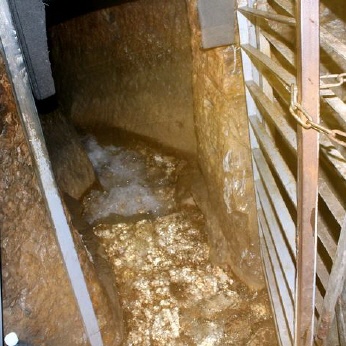
Identify the location of hallway. This screenshot has height=346, width=346. (110, 89).